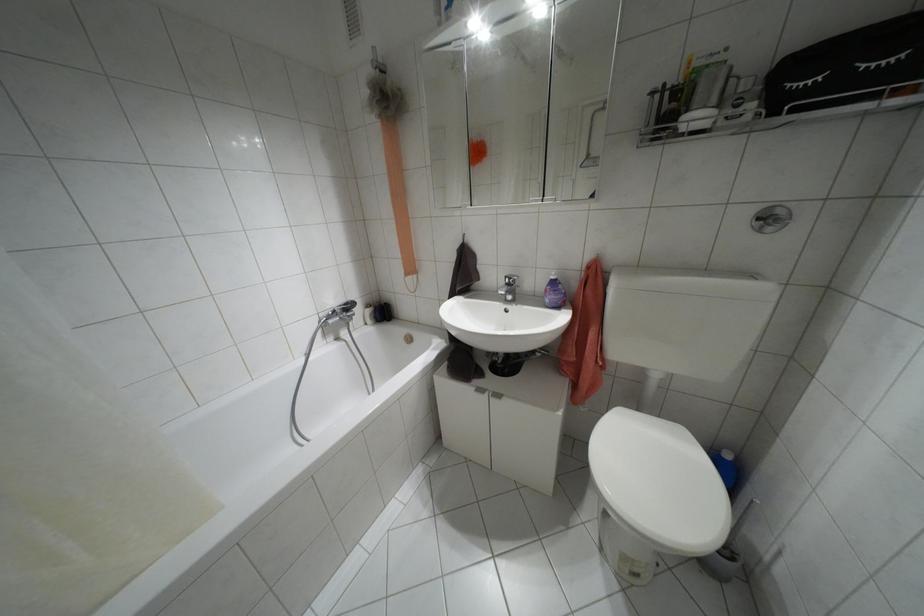
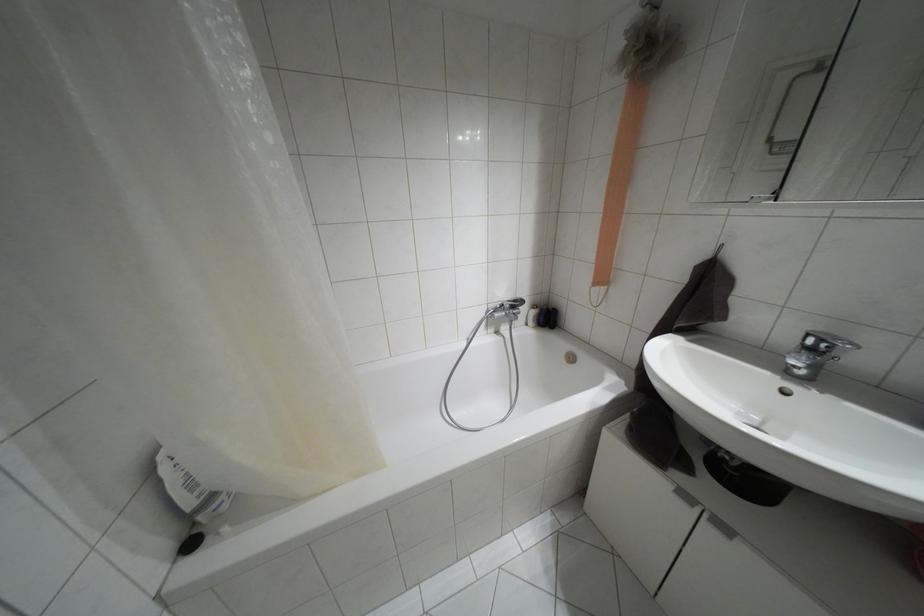
In the second image, find the point that corresponds to pixel 496 395 in the first image.

(723, 528)